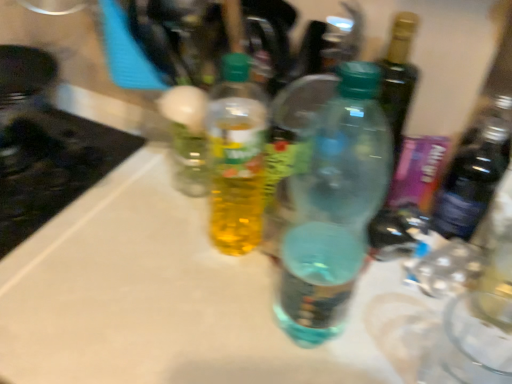
This screenshot has height=384, width=512. I want to click on blank space situated above black glass stove at left (from a real-world perspective), so click(x=35, y=163).